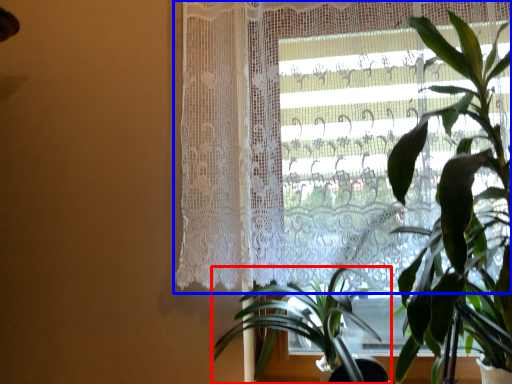
Question: Which of the following is the closest to the observer, houseplant (highlighted by a red box) or curtain (highlighted by a blue box)?

Choices:
 (A) houseplant
 (B) curtain

Answer: (A)